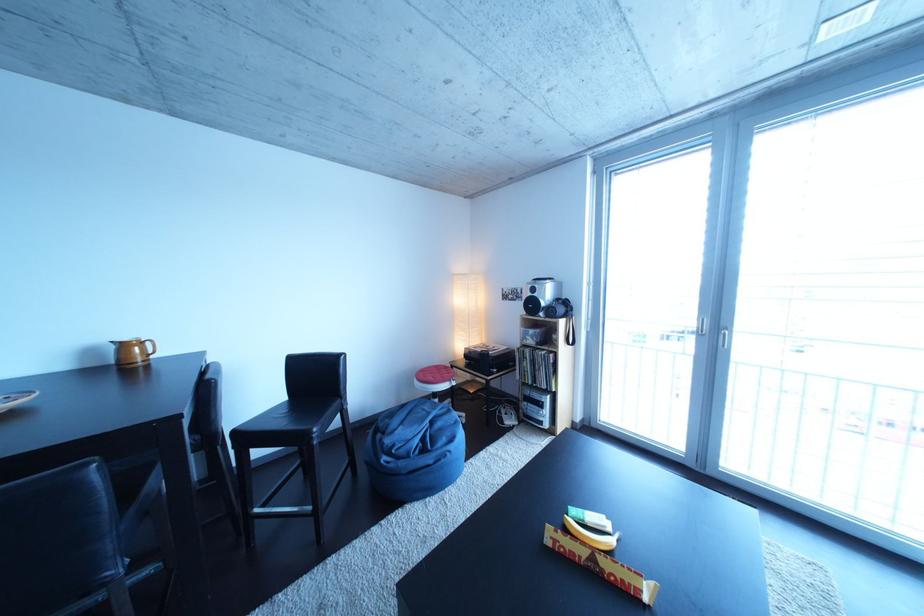
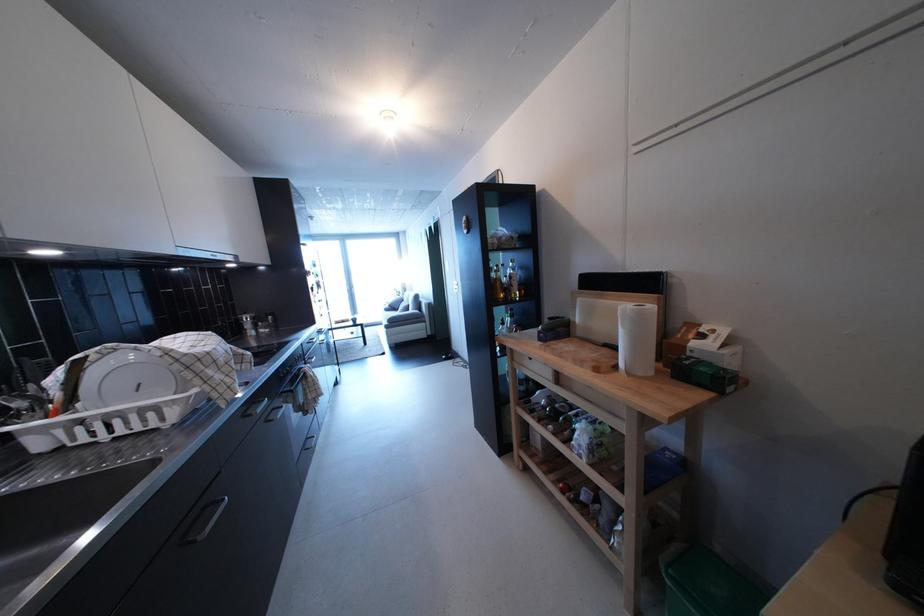
Question: I am providing you with two images of the same scene from different viewpoints. Please identify which objects are invisible in image2.

Choices:
 (A) small white box
 (B) wooden drawer handle
 (C) thermostat dial
 (D) black binoculars

Answer: (D)